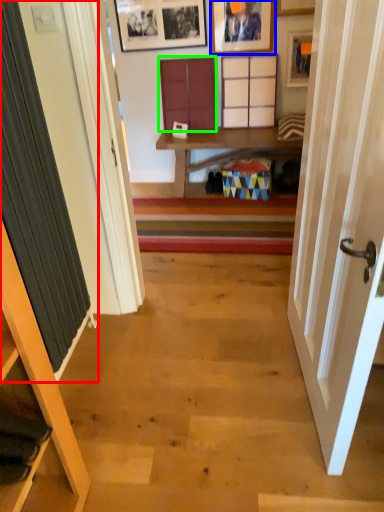
Question: Which object is the farthest from curtain (highlighted by a red box)? Choose among these: picture frame (highlighted by a blue box) or cabinet (highlighted by a green box).

Choices:
 (A) picture frame
 (B) cabinet

Answer: (A)